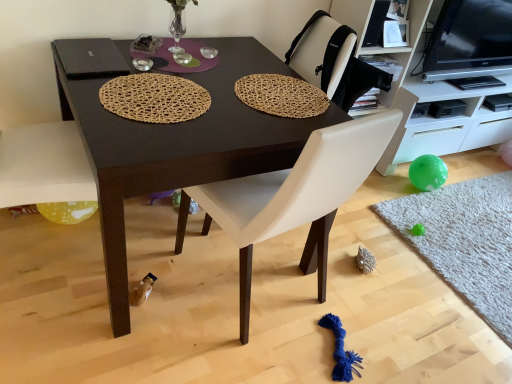
This screenshot has height=384, width=512. What are the coordinates of `vacant space in between white leather chair at center and dark brown wood table at center` in the screenshot? It's located at (198, 335).